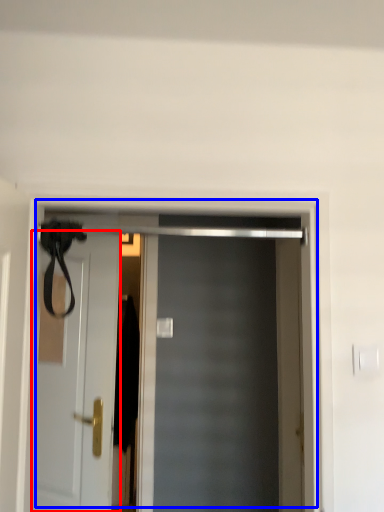
Question: Among these objects, which one is nearest to the camera, door (highlighted by a red box) or door (highlighted by a blue box)?

Choices:
 (A) door
 (B) door

Answer: (B)